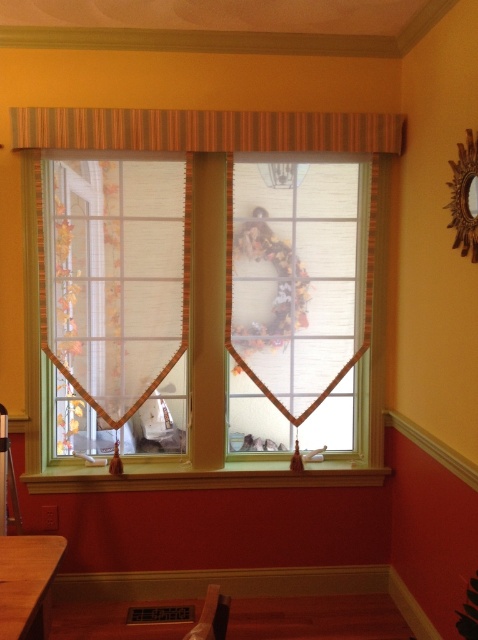
Question: Which point is closer to the camera?

Choices:
 (A) (351, 332)
 (B) (44, 492)
 (C) (122, 403)

Answer: (B)

Question: Which point appears closest to the camera in this image?

Choices:
 (A) (282, 125)
 (B) (386, 113)
 (C) (314, 228)
 (D) (111, 237)

Answer: (A)

Question: Can you confirm if translucent beige blind at center is positioned above brown wooden table at lower left?

Choices:
 (A) yes
 (B) no

Answer: (A)

Question: Does translucent fabric valance at center lie behind brown wooden table at lower left?

Choices:
 (A) yes
 (B) no

Answer: (A)

Question: In this image, where is translucent fabric valance at center located relative to wooden at lower center?

Choices:
 (A) below
 (B) above

Answer: (B)

Question: Which of the following is the closest to the observer?

Choices:
 (A) (286, 374)
 (B) (134, 468)

Answer: (B)